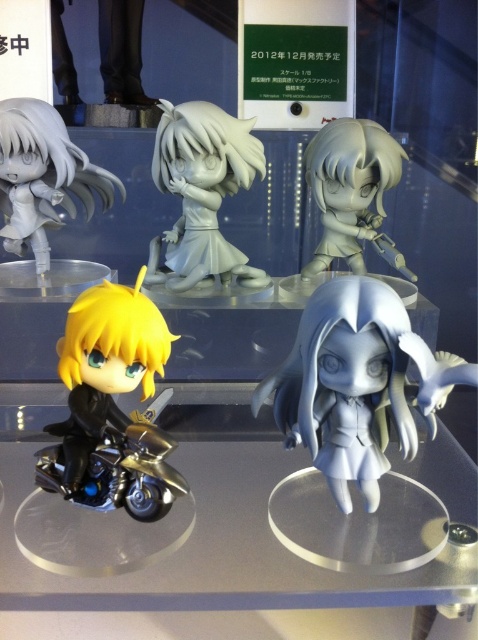
Is clear acrylic glass table at lower center wider than shiny metallic motorcycle at lower left?

Yes.

Can you confirm if clear acrylic glass table at lower center is positioned above shiny metallic motorcycle at lower left?

Actually, clear acrylic glass table at lower center is below shiny metallic motorcycle at lower left.

Which is in front, point (415, 465) or point (54, 448)?

Point (54, 448) is more forward.

The image size is (478, 640). I want to click on clear acrylic glass table at lower center, so click(217, 548).

Locate an element on the screen. This screenshot has height=640, width=478. clear acrylic glass table at lower center is located at coordinates (217, 548).

This screenshot has height=640, width=478. What are the coordinates of `clear acrylic glass table at lower center` in the screenshot? It's located at (217, 548).

The height and width of the screenshot is (640, 478). Find the location of `clear acrylic glass table at lower center`. clear acrylic glass table at lower center is located at coordinates (217, 548).

Is point (474, 481) positioned in front of point (343, 200)?

Yes, it is.

Does point (195, 576) come behind point (332, 141)?

That is False.

Image resolution: width=478 pixels, height=640 pixels. I want to click on clear acrylic glass table at lower center, so tap(217, 548).